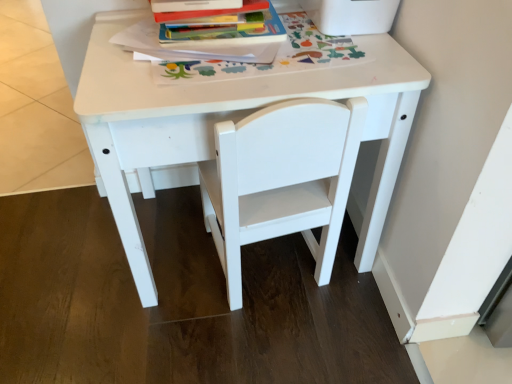
Image resolution: width=512 pixels, height=384 pixels. Identify the location of free space in front of white matte chair at center. (267, 342).